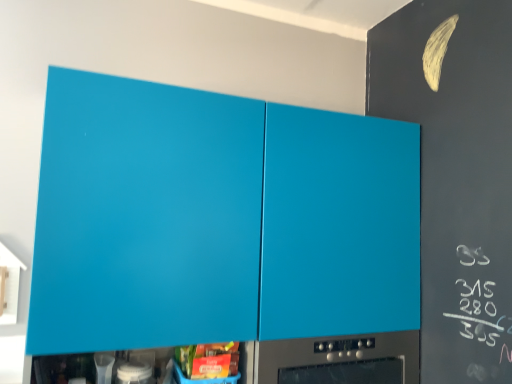
Question: Can you confirm if matte plastic container at lower center is thinner than matte blue cabinet at upper center?

Choices:
 (A) no
 (B) yes

Answer: (B)

Question: Is matte plastic container at lower center bigger than matte blue cabinet at upper center?

Choices:
 (A) yes
 (B) no

Answer: (B)

Question: Is matte plastic container at lower center oriented away from matte blue cabinet at upper center?

Choices:
 (A) no
 (B) yes

Answer: (B)

Question: Is matte plastic container at lower center smaller than matte blue cabinet at upper center?

Choices:
 (A) yes
 (B) no

Answer: (A)

Question: Is matte plastic container at lower center wider than matte blue cabinet at upper center?

Choices:
 (A) no
 (B) yes

Answer: (A)

Question: Does matte plastic container at lower center turn towards matte blue cabinet at upper center?

Choices:
 (A) no
 (B) yes

Answer: (B)

Question: Considering the relative sizes of matte blue cabinet at upper center and white glossy container at lower center in the image provided, is matte blue cabinet at upper center thinner than white glossy container at lower center?

Choices:
 (A) no
 (B) yes

Answer: (A)

Question: Is matte blue cabinet at upper center turned away from white glossy container at lower center?

Choices:
 (A) yes
 (B) no

Answer: (A)

Question: Does matte blue cabinet at upper center have a greater height compared to white glossy container at lower center?

Choices:
 (A) no
 (B) yes

Answer: (B)

Question: Does matte blue cabinet at upper center have a greater width compared to white glossy container at lower center?

Choices:
 (A) yes
 (B) no

Answer: (A)

Question: Is matte blue cabinet at upper center bigger than white glossy container at lower center?

Choices:
 (A) no
 (B) yes

Answer: (B)

Question: Is matte blue cabinet at upper center further to the viewer compared to white glossy container at lower center?

Choices:
 (A) yes
 (B) no

Answer: (B)

Question: Can matte plastic container at lower center be found inside white glossy container at lower center?

Choices:
 (A) yes
 (B) no

Answer: (B)